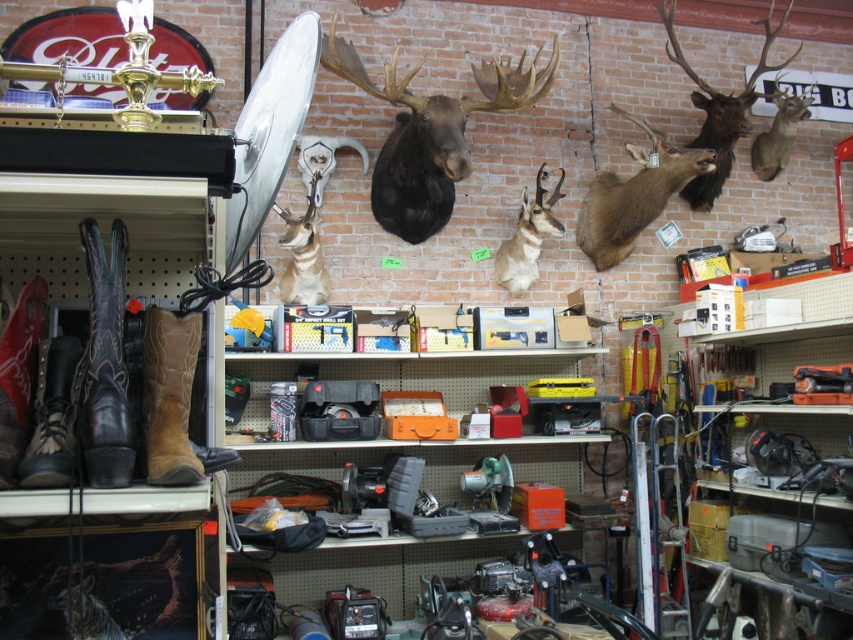
Can you confirm if brown velvet deer head at upper right is thinner than brown matte antelope at center?

No.

Based on the photo, is the position of brown velvet deer head at upper right less distant than that of brown matte antelope at center?

Yes, brown velvet deer head at upper right is in front of brown matte antelope at center.

Describe the element at coordinates (718, 108) in the screenshot. I see `brown velvet deer head at upper right` at that location.

Identify the location of brown velvet deer head at upper right. This screenshot has height=640, width=853. (718, 108).

Measure the distance from leather/cowhide cowboy boot at lower left to red leather boot at left.

The distance of leather/cowhide cowboy boot at lower left from red leather boot at left is 1.61 inches.

Is leather/cowhide cowboy boot at lower left closer to the viewer compared to red leather boot at left?

Yes.

Between point (53, 358) and point (25, 388), which one is positioned behind?

The point (53, 358) is behind.

Locate an element on the screen. The image size is (853, 640). leather/cowhide cowboy boot at lower left is located at coordinates (53, 417).

Who is taller, black matte moose head at center or leather/cowhide cowboy boot at lower left?

black matte moose head at center is taller.

You are a GUI agent. You are given a task and a screenshot of the screen. Output one action in this format:
    pyautogui.click(x=<x>, y=<y>)
    Task: Click on the black matte moose head at center
    
    Given the screenshot: What is the action you would take?
    pyautogui.click(x=430, y=132)

Does point (514, 72) lie behind point (44, 390)?

Yes, point (514, 72) is behind point (44, 390).

Find the location of a particular element. This screenshot has width=853, height=640. black matte moose head at center is located at coordinates [430, 132].